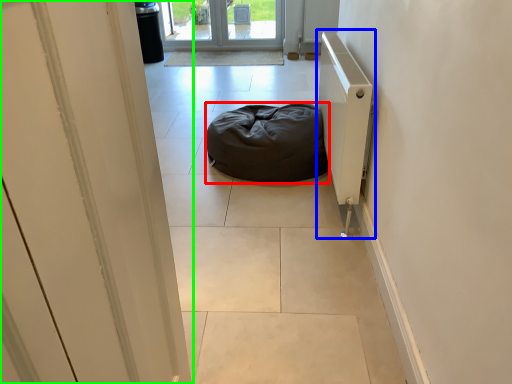
Question: Estimate the real-world distances between objects in this image. Which object is closer to furniture (highlighted by a red box), radiator (highlighted by a blue box) or door (highlighted by a green box)?

Choices:
 (A) radiator
 (B) door

Answer: (A)